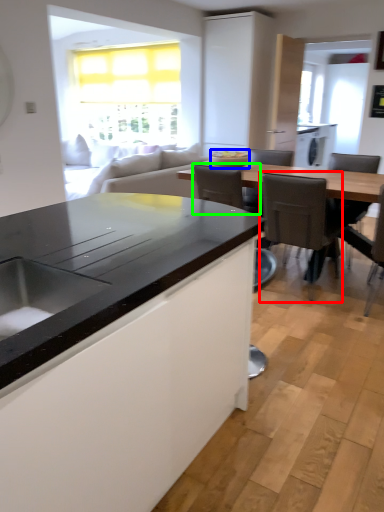
Question: Which object is the farthest from chair (highlighted by a red box)? Choose among these: appliance (highlighted by a blue box) or armchair (highlighted by a green box).

Choices:
 (A) appliance
 (B) armchair

Answer: (A)